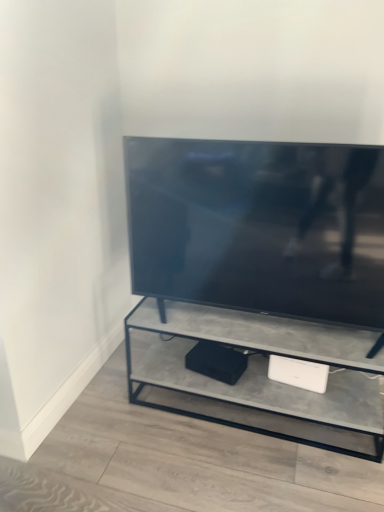
Describe the element at coordinates (217, 361) in the screenshot. I see `black matte speaker at lower center` at that location.

At what (x,y) coordinates should I click in order to perform the action: click on black matte speaker at lower center. Please return your answer as a coordinate pair (x, y). The height and width of the screenshot is (512, 384). Looking at the image, I should click on (217, 361).

The width and height of the screenshot is (384, 512). I want to click on black matte speaker at lower center, so click(x=217, y=361).